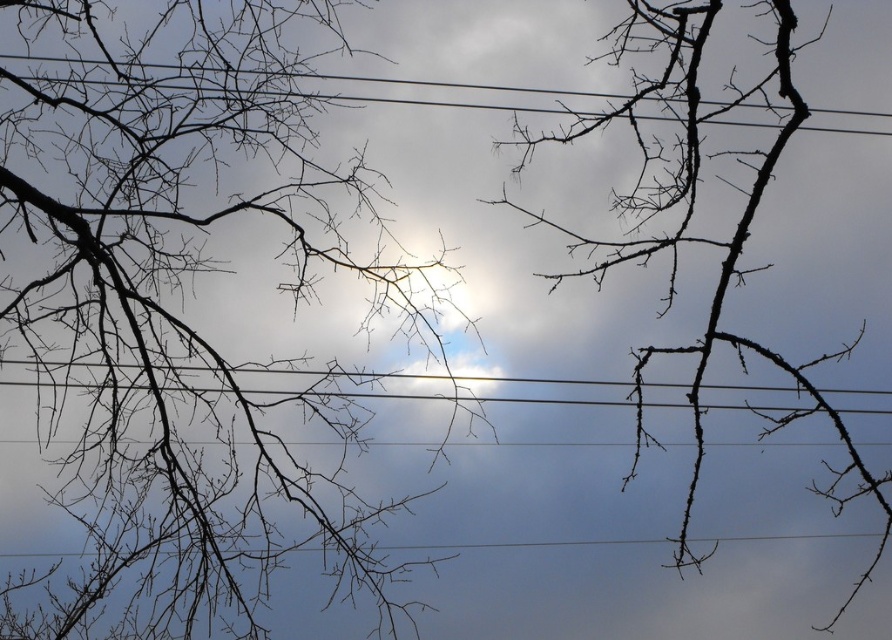
Can you confirm if dark brown branches at center is positioned below black wire at upper center?

Yes.

Image resolution: width=892 pixels, height=640 pixels. Describe the element at coordinates (703, 237) in the screenshot. I see `dark brown branches at center` at that location.

Where is `dark brown branches at center`? The height and width of the screenshot is (640, 892). dark brown branches at center is located at coordinates click(x=703, y=237).